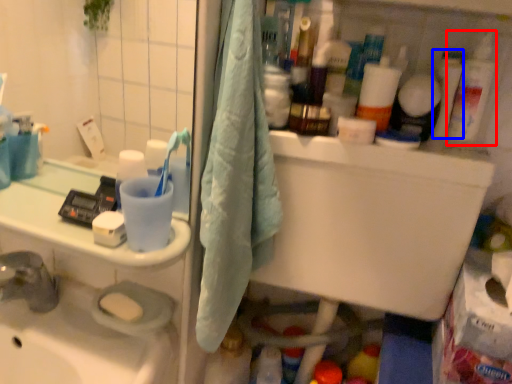
Question: Which object is further to the camera taking this photo, cleaning product (highlighted by a red box) or toiletry (highlighted by a blue box)?

Choices:
 (A) cleaning product
 (B) toiletry

Answer: (B)